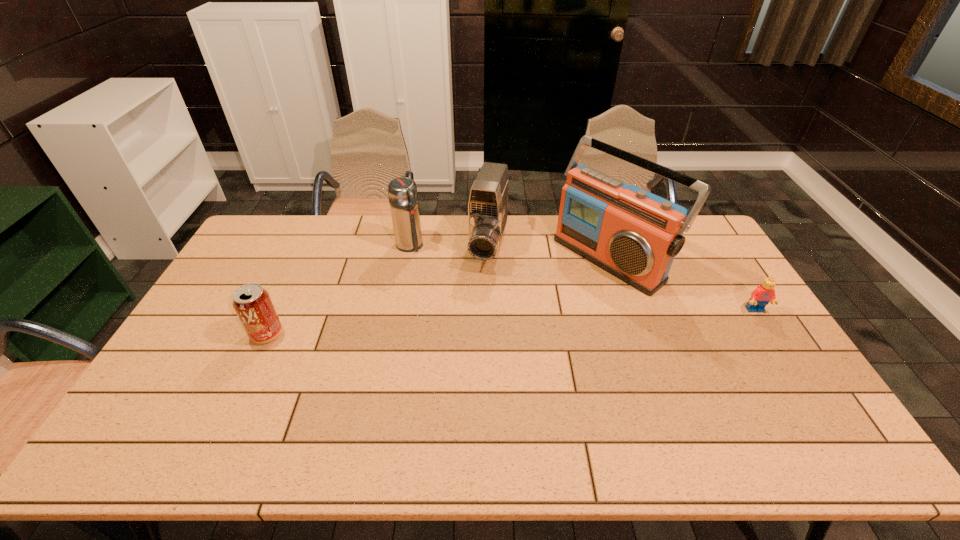
The image size is (960, 540). Identify the location of the fourth tallest object. (252, 303).

The image size is (960, 540). In order to click on the leftmost object in this screenshot , I will do `click(252, 303)`.

The image size is (960, 540). I want to click on the rightmost object, so click(763, 294).

Identify the location of the shortest object. This screenshot has height=540, width=960. (763, 294).

The height and width of the screenshot is (540, 960). I want to click on thermos bottle, so coord(402,192).

Find the location of a particular element. The width and height of the screenshot is (960, 540). the third object from right to left is located at coordinates (488, 202).

At what (x,y) coordinates should I click in order to perform the action: click on the tallest object. Please return your answer as a coordinate pair (x, y). The width and height of the screenshot is (960, 540). Looking at the image, I should click on (633, 234).

Where is `the second object from right to left`? This screenshot has height=540, width=960. the second object from right to left is located at coordinates (633, 234).

At what (x,y) coordinates should I click in order to perform the action: click on vacant space located on the right of the leftmost object. Please return your answer as a coordinate pair (x, y). Looking at the image, I should click on (348, 334).

Where is `vacant space located on the face of the Lego`? The height and width of the screenshot is (540, 960). vacant space located on the face of the Lego is located at coordinates (805, 389).